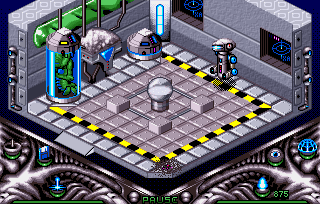
This screenshot has width=320, height=204. I want to click on green light, so click(x=44, y=27).